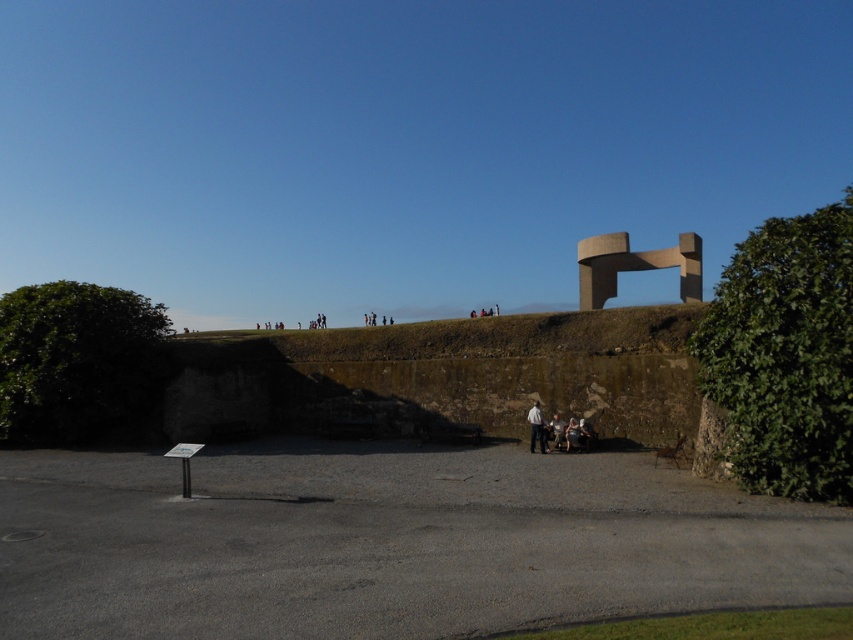
Does green leafy hedge at right lie behind green leafy hedge at left?

No, it is not.

Does point (805, 458) come in front of point (45, 435)?

That is True.

Locate an element on the screen. green leafy hedge at right is located at coordinates (785, 355).

Does green leafy hedge at right appear on the left side of light gray fabric pants at center?

In fact, green leafy hedge at right is to the right of light gray fabric pants at center.

Can you confirm if green leafy hedge at right is positioned to the right of light gray fabric pants at center?

Correct, you'll find green leafy hedge at right to the right of light gray fabric pants at center.

Is point (821, 356) positioned behind point (538, 442)?

No, it is in front of (538, 442).

Image resolution: width=853 pixels, height=640 pixels. What are the coordinates of `green leafy hedge at right` in the screenshot? It's located at click(x=785, y=355).

Does green leafy hedge at left have a greater height compared to light gray fabric pants at center?

Correct, green leafy hedge at left is much taller as light gray fabric pants at center.

Is point (4, 413) farther from camera compared to point (531, 413)?

That is True.

At what (x,y) coordinates should I click in order to perform the action: click on green leafy hedge at left. Please return your answer as a coordinate pair (x, y). This screenshot has width=853, height=640. Looking at the image, I should click on (76, 358).